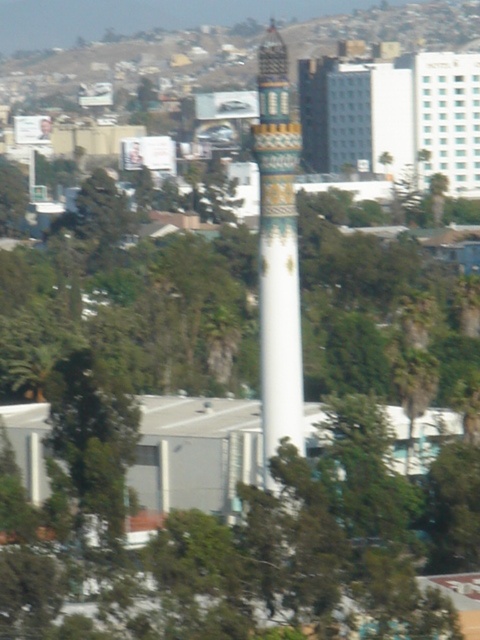
Question: Considering the relative positions of gold mosaic minaret at center and green leafy tree at lower left in the image provided, where is gold mosaic minaret at center located with respect to green leafy tree at lower left?

Choices:
 (A) left
 (B) right

Answer: (B)

Question: Can you confirm if gold mosaic minaret at center is positioned to the left of green leafy tree at lower left?

Choices:
 (A) yes
 (B) no

Answer: (B)

Question: Which point is farther to the camera?

Choices:
 (A) (266, 150)
 (B) (67, 454)

Answer: (A)

Question: Which object appears closest to the camera in this image?

Choices:
 (A) gold mosaic minaret at center
 (B) green leafy tree at lower left

Answer: (B)

Question: Which point is closer to the camera taking this photo?

Choices:
 (A) (70, 515)
 (B) (277, 381)

Answer: (A)

Question: Does gold mosaic minaret at center appear on the left side of green leafy tree at lower left?

Choices:
 (A) no
 (B) yes

Answer: (A)